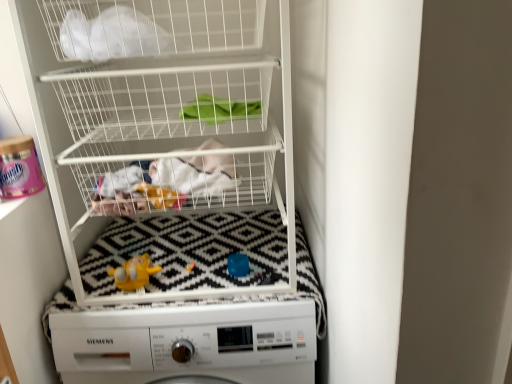
Find the location of `vacant space to the right of yellow rubber duck at center`. vacant space to the right of yellow rubber duck at center is located at coordinates (196, 281).